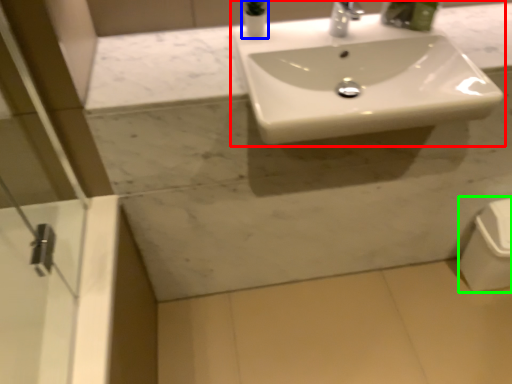
Question: Considering the real-world distances, which object is closest to sink (highlighted by a red box)? toiletry (highlighted by a blue box) or porcelain (highlighted by a green box).

Choices:
 (A) toiletry
 (B) porcelain

Answer: (A)